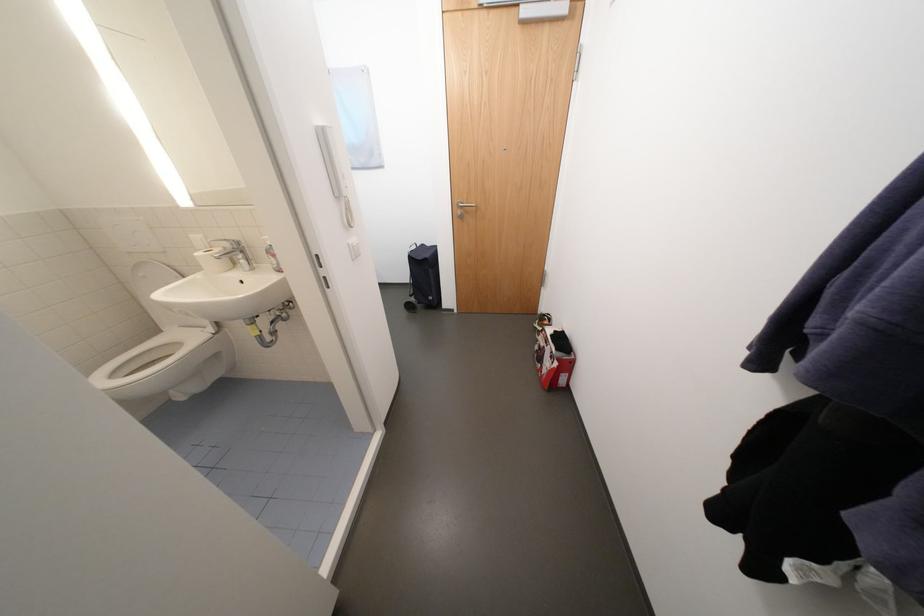
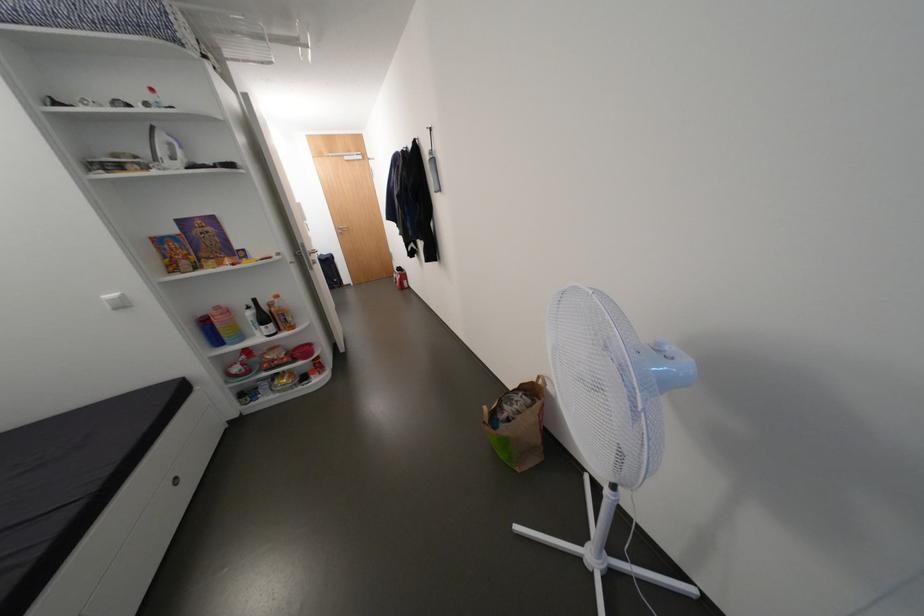
In the second image, find the point that corresponds to point 560,336 in the first image.

(405, 270)